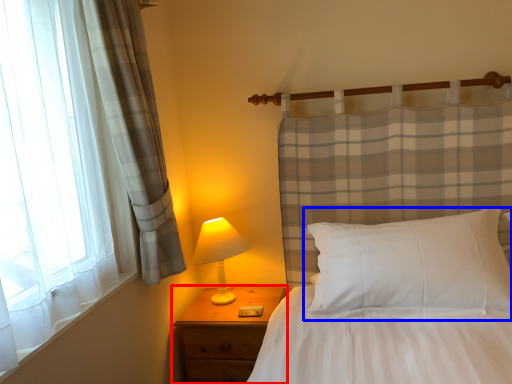
Question: Which object is further to the camera taking this photo, nightstand (highlighted by a red box) or pillow (highlighted by a blue box)?

Choices:
 (A) nightstand
 (B) pillow

Answer: (A)